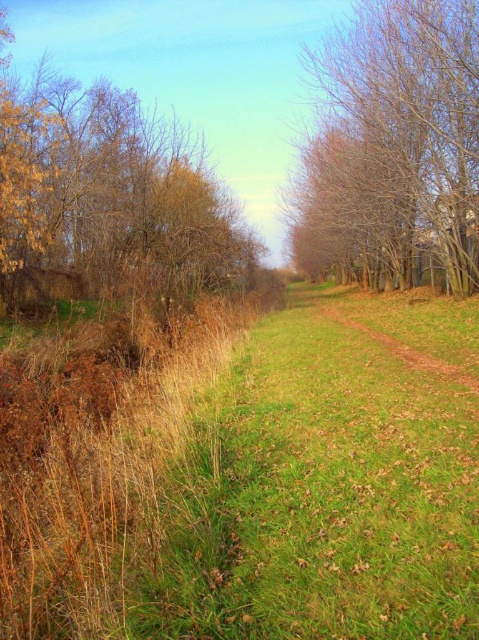
You are a hiker trying to navigate through the grassy area. The path is narrow, and you need to know which area is wider to avoid getting stuck. Which is wider between the brown dry grass at left and the bare branches at center?

The brown dry grass at left is wider than the bare branches at center, so you should choose the brown dry grass at left to avoid getting stuck.

You are standing at the center of the image and want to walk towards the dense cluster of shrubs and small trees on the left. Is the brown dry grass at left in your direct path?

The brown dry grass at left is located at point (109, 200), which is to the left side of the image. Since you are moving towards the dense cluster of shrubs and small trees on the left, the brown dry grass at left would be in your direct path.